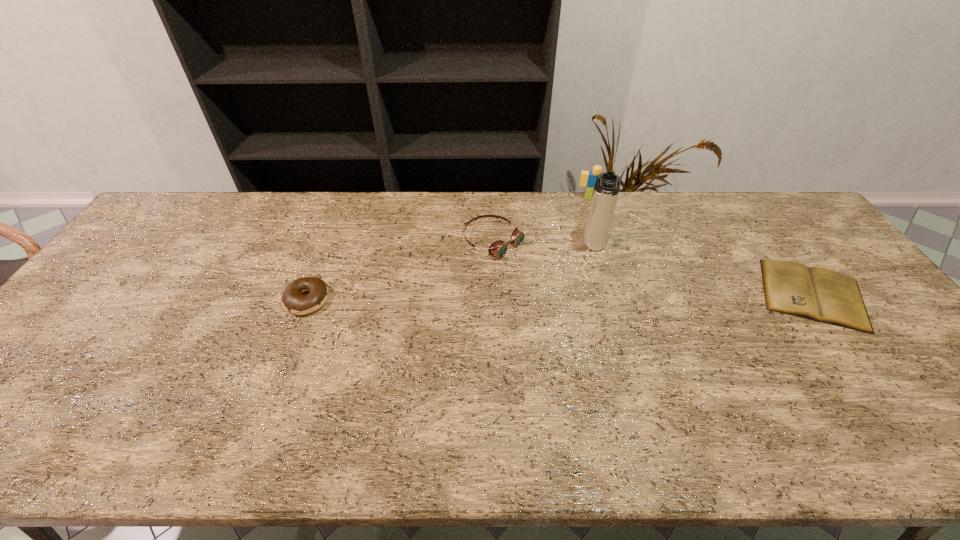
Where is `goggles that is at the far edge`? The image size is (960, 540). goggles that is at the far edge is located at coordinates tap(499, 248).

The width and height of the screenshot is (960, 540). What are the coordinates of `Lego that is at the far edge` in the screenshot? It's located at (588, 179).

The width and height of the screenshot is (960, 540). I want to click on object positioned at the right edge, so click(x=820, y=294).

This screenshot has height=540, width=960. I want to click on free space at the far edge, so click(314, 192).

The image size is (960, 540). Identify the location of free space at the near edge of the desktop. (568, 408).

Where is `free space at the left edge of the desktop`? free space at the left edge of the desktop is located at coordinates (119, 325).

You are a GUI agent. You are given a task and a screenshot of the screen. Output one action in this format:
    pyautogui.click(x=<x>, y=<y>)
    Task: Click on the free space at the right edge
    This screenshot has height=540, width=960.
    Given the screenshot: What is the action you would take?
    pyautogui.click(x=909, y=366)

Find the location of a particular element. This screenshot has height=540, width=960. vacant area at the far left corner of the desktop is located at coordinates (190, 213).

In the image, there is a desktop. Identify the location of free space at the far right corner. The height and width of the screenshot is (540, 960). (768, 208).

Find the location of a particular element. The width and height of the screenshot is (960, 540). vacant area between the fourth tallest object and the tallest object is located at coordinates (450, 274).